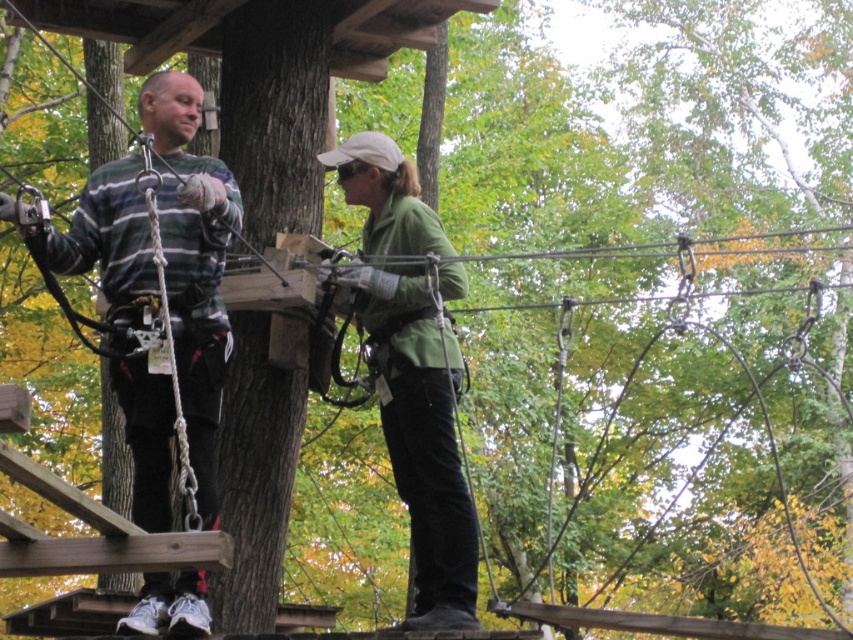
From the picture: Based on the scene description, can you determine which individual has a wider torso between the striped sweater at left and the green matte jacket at center?

The striped sweater at left might be wider than the green matte jacket at center according to the description.